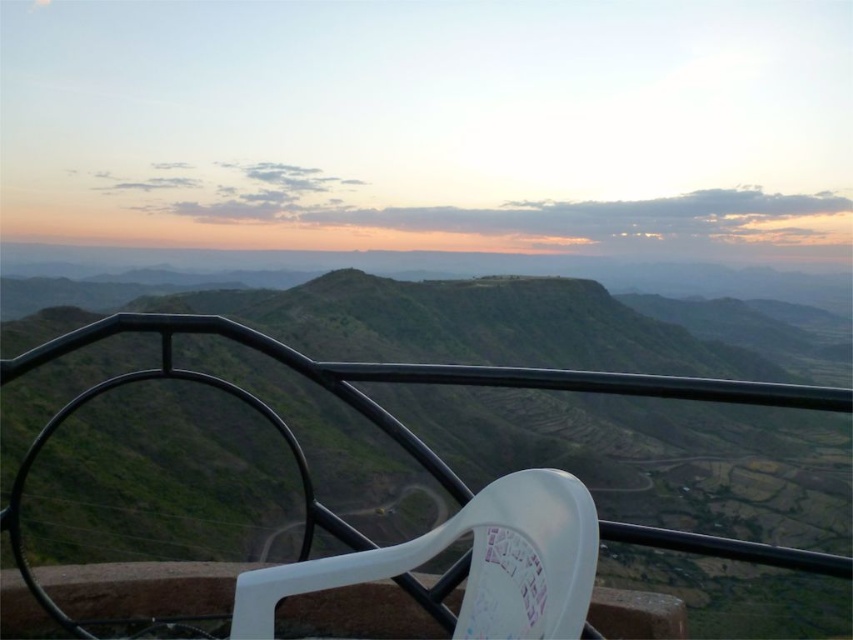
Question: Which object appears farthest from the camera in this image?

Choices:
 (A) green matte hill at center
 (B) white plastic chair at center

Answer: (A)

Question: Which point is farther from the camera taking this photo?

Choices:
 (A) (360, 509)
 (B) (556, 515)

Answer: (A)

Question: Can you confirm if green matte hill at center is positioned to the left of white plastic chair at center?

Choices:
 (A) yes
 (B) no

Answer: (A)

Question: Where is green matte hill at center located in relation to white plastic chair at center in the image?

Choices:
 (A) above
 (B) below

Answer: (A)

Question: Which of the following is the closest to the observer?

Choices:
 (A) green matte hill at center
 (B) white plastic chair at center

Answer: (B)

Question: Can you confirm if green matte hill at center is positioned to the right of white plastic chair at center?

Choices:
 (A) yes
 (B) no

Answer: (B)